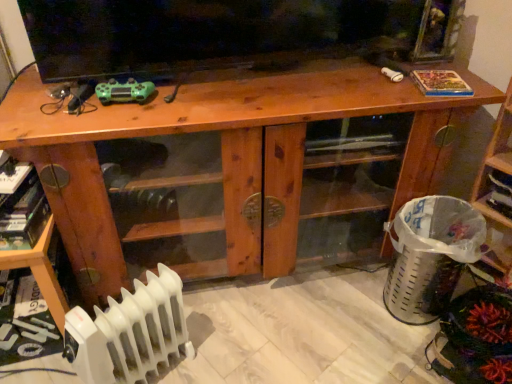
Locate an element on the screen. The image size is (512, 384). vacant space underneath matte black tv at upper center (from a real-world perspective) is located at coordinates (270, 67).